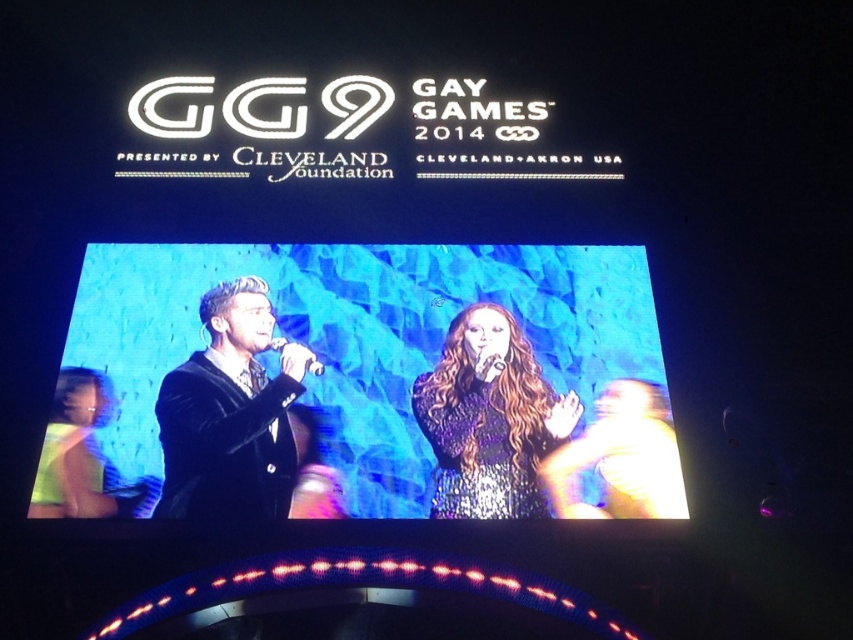
Question: Can you confirm if velvet black suit at center is wider than metallic silver microphone at center?

Choices:
 (A) yes
 (B) no

Answer: (A)

Question: Does white plastic microphone at center appear over metallic silver microphone at center?

Choices:
 (A) no
 (B) yes

Answer: (B)

Question: Among these objects, which one is farthest from the camera?

Choices:
 (A) metallic silver microphone at center
 (B) white plastic microphone at center
 (C) black velvet suit at center

Answer: (A)

Question: Which point is farther to the camera?

Choices:
 (A) (631, 440)
 (B) (485, 360)
 (C) (500, 323)
 (D) (271, 342)

Answer: (C)

Question: Can you confirm if shiny sequined dress at center is smaller than white plastic microphone at center?

Choices:
 (A) no
 (B) yes

Answer: (A)

Question: Estimate the real-world distances between objects in this image. Which object is closer to the metallic silver microphone at center?

Choices:
 (A) white plastic microphone at center
 (B) black velvet suit at center
 (C) velvet black suit at center
 (D) shiny sequined dress at center

Answer: (D)